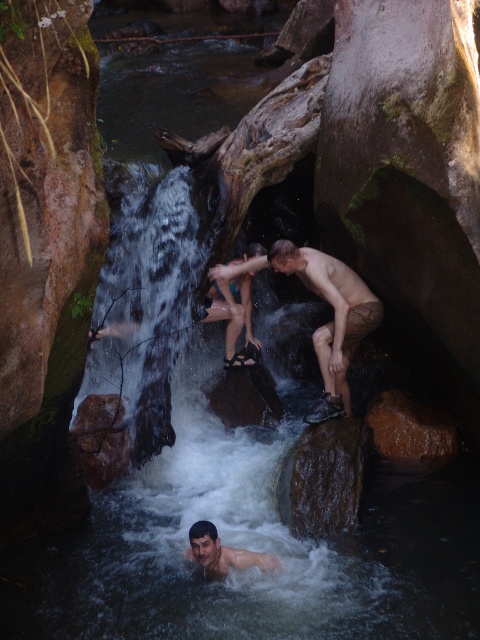
Is smooth skin man at center bigger than smooth skin man at lower center?

Indeed, smooth skin man at center has a larger size compared to smooth skin man at lower center.

Which is above, smooth skin man at center or smooth skin man at lower center?

smooth skin man at center is above.

Is point (268, 266) more distant than point (263, 561)?

Yes, it is behind point (263, 561).

This screenshot has height=640, width=480. In order to click on smooth skin man at center in this screenshot , I will do `click(326, 323)`.